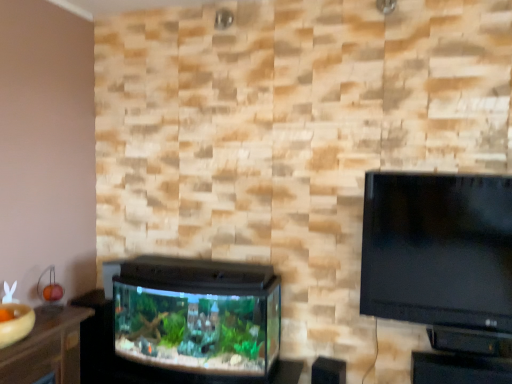
Question: Can you confirm if black plastic table at lower right is positioned to the left of wooden table at lower left?

Choices:
 (A) yes
 (B) no

Answer: (B)

Question: From a real-world perspective, is black plastic table at lower right below wooden table at lower left?

Choices:
 (A) no
 (B) yes

Answer: (B)

Question: Can you confirm if black plastic table at lower right is wider than wooden table at lower left?

Choices:
 (A) yes
 (B) no

Answer: (B)

Question: Is black plastic table at lower right further to the viewer compared to wooden table at lower left?

Choices:
 (A) no
 (B) yes

Answer: (B)

Question: Is black plastic table at lower right positioned far away from wooden table at lower left?

Choices:
 (A) yes
 (B) no

Answer: (A)

Question: Is point (114, 264) closer or farther from the camera than point (435, 354)?

Choices:
 (A) closer
 (B) farther

Answer: (B)

Question: Considering the positions of black plastic aquarium at lower left and black plastic table at lower right in the image, is black plastic aquarium at lower left wider or thinner than black plastic table at lower right?

Choices:
 (A) thin
 (B) wide

Answer: (B)

Question: Looking at the image, does black plastic aquarium at lower left seem bigger or smaller compared to black plastic table at lower right?

Choices:
 (A) small
 (B) big

Answer: (B)

Question: Considering the relative positions of black plastic aquarium at lower left and black plastic table at lower right in the image provided, is black plastic aquarium at lower left to the left or to the right of black plastic table at lower right?

Choices:
 (A) right
 (B) left

Answer: (B)

Question: In terms of width, does black plastic table at lower right look wider or thinner when compared to wooden table at lower left?

Choices:
 (A) wide
 (B) thin

Answer: (B)

Question: Is black plastic table at lower right inside or outside of wooden table at lower left?

Choices:
 (A) inside
 (B) outside

Answer: (B)

Question: Considering their positions, is black plastic table at lower right located in front of or behind wooden table at lower left?

Choices:
 (A) front
 (B) behind

Answer: (B)

Question: Considering the relative positions of black plastic table at lower right and wooden table at lower left in the image provided, is black plastic table at lower right to the left or to the right of wooden table at lower left?

Choices:
 (A) left
 (B) right

Answer: (B)

Question: Is wooden table at lower left taller or shorter than black plastic table at lower right?

Choices:
 (A) short
 (B) tall

Answer: (A)

Question: In the image, is wooden table at lower left on the left side or the right side of black plastic table at lower right?

Choices:
 (A) left
 (B) right

Answer: (A)